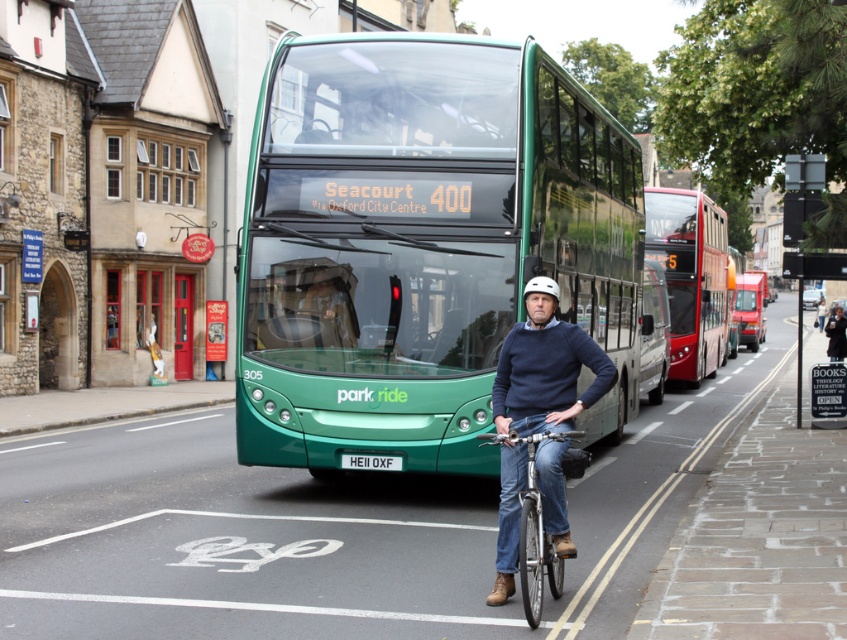
Can you confirm if denim jeans at center is positioned below black metal sign at right?

Indeed, denim jeans at center is positioned under black metal sign at right.

Does point (507, 497) come in front of point (801, 316)?

Yes, it is in front of point (801, 316).

What are the coordinates of `denim jeans at center` in the screenshot? It's located at (545, 368).

Is metallic silver bicycle at center taller than white plastic license plate at center?

Indeed, metallic silver bicycle at center has a greater height compared to white plastic license plate at center.

Does metallic silver bicycle at center appear under white plastic license plate at center?

Correct, metallic silver bicycle at center is located below white plastic license plate at center.

Which is in front, point (582, 435) or point (349, 468)?

Positioned in front is point (582, 435).

This screenshot has height=640, width=847. Find the location of `metallic silver bicycle at center`. metallic silver bicycle at center is located at coordinates (534, 525).

Is red metallic bus at right further to the viewer compared to metallic silver bicycle at center?

Yes, it is.

Between red metallic bus at right and metallic silver bicycle at center, which one is positioned higher?

red metallic bus at right

Is point (709, 275) closer to viewer compared to point (566, 433)?

No.

Locate an element on the screen. The image size is (847, 640). red metallic bus at right is located at coordinates (690, 276).